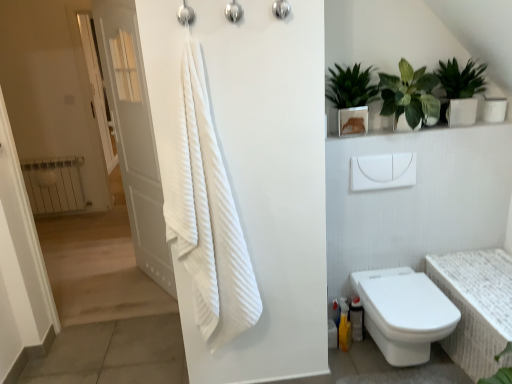
What do you see at coordinates (351, 98) in the screenshot?
I see `green glossy plant at upper right, arranged as the 3th houseplant when viewed from the right` at bounding box center [351, 98].

Measure the distance between white textured towel at center and camera.

4.82 feet.

What are the coordinates of `white textured towel at center` in the screenshot? It's located at (268, 187).

In order to click on white wood door at left in this screenshot , I will do `click(134, 137)`.

This screenshot has width=512, height=384. I want to click on white metallic radiator at left, so pos(54,184).

Locate an element on the screen. The width and height of the screenshot is (512, 384). green glossy plant at upper right, the 3th houseplant from the left is located at coordinates (460, 91).

From the white textured towel at center, count 1st shower to the right and point to it. Please provide its 2D coordinates.

[(233, 12)]

Consider the image. From a real-world perspective, which object rests below the other?

In real-world perspective, white textured towel at center is lower.

Could you measure the distance between white textured towel at center and brushed metal shower head at upper center, arranged as the 2th shower when viewed from the right?

white textured towel at center and brushed metal shower head at upper center, arranged as the 2th shower when viewed from the right, are 30.93 inches apart from each other.

Which of these two, brushed metal shower head at upper center, arranged as the 2th shower when viewed from the right, or brushed metal shower at upper center, which appears as the 1th shower when viewed from the left, is thinner?

brushed metal shower head at upper center, arranged as the 2th shower when viewed from the right.

What's the angular difference between brushed metal shower head at upper center, arranged as the 2th shower when viewed from the right, and brushed metal shower at upper center, which appears as the 1th shower when viewed from the left,'s facing directions?

0.000513 degrees separate the facing orientations of brushed metal shower head at upper center, arranged as the 2th shower when viewed from the right, and brushed metal shower at upper center, which appears as the 1th shower when viewed from the left.

Are brushed metal shower head at upper center, arranged as the 2th shower when viewed from the right, and brushed metal shower at upper center, acting as the 3th shower starting from the right, making contact?

No, brushed metal shower head at upper center, arranged as the 2th shower when viewed from the right, is not next to brushed metal shower at upper center, acting as the 3th shower starting from the right.

Considering the sizes of brushed metal shower head at upper center, which ranks as the 2th shower in left-to-right order, and brushed metal shower at upper center, which appears as the 1th shower when viewed from the left, in the image, is brushed metal shower head at upper center, which ranks as the 2th shower in left-to-right order, bigger or smaller than brushed metal shower at upper center, which appears as the 1th shower when viewed from the left,?

Clearly, brushed metal shower head at upper center, which ranks as the 2th shower in left-to-right order, is larger in size than brushed metal shower at upper center, which appears as the 1th shower when viewed from the left.

Between white plastic towel bar at upper center and metallic silver shower head at upper center, the first shower viewed from the right, which one has more height?

With more height is white plastic towel bar at upper center.

Does white plastic towel bar at upper center touch metallic silver shower head at upper center, the third shower when ordered from left to right?

white plastic towel bar at upper center and metallic silver shower head at upper center, the third shower when ordered from left to right, are clearly separated.

Which is behind, white plastic towel bar at upper center or metallic silver shower head at upper center, the third shower when ordered from left to right?

white plastic towel bar at upper center is behind.

Which is correct: white plastic towel bar at upper center is inside metallic silver shower head at upper center, the first shower viewed from the right, or outside of it?

white plastic towel bar at upper center cannot be found inside metallic silver shower head at upper center, the first shower viewed from the right.

Can you confirm if white textured bath at lower right is bigger than white metallic radiator at left?

Yes.

In the scene shown: Which of these two, white textured bath at lower right or white metallic radiator at left, stands shorter?

Standing shorter between the two is white textured bath at lower right.

From the image's perspective, is white textured bath at lower right beneath white metallic radiator at left?

Yes, from the image's perspective, white textured bath at lower right is below white metallic radiator at left.

Is white textured bath at lower right facing away from white metallic radiator at left?

No, white textured bath at lower right is not facing away from white metallic radiator at left.

Is white textured towel at center in contact with white glossy toilet at lower right?

white textured towel at center is not next to white glossy toilet at lower right, and they're not touching.

Is white textured towel at center to the left of white glossy toilet at lower right from the viewer's perspective?

Yes, white textured towel at center is to the left of white glossy toilet at lower right.

Looking at the image, does white textured towel at center seem bigger or smaller compared to white glossy toilet at lower right?

white textured towel at center is bigger than white glossy toilet at lower right.

Is white textured towel at center surrounding white glossy toilet at lower right?

No, white glossy toilet at lower right is not a part of white textured towel at center.

The width and height of the screenshot is (512, 384). What are the coordinates of `towel bar below the metallic silver shower head at upper center, the first shower viewed from the right (from a real-world perspective)` in the screenshot? It's located at [383, 171].

Is metallic silver shower head at upper center, the first shower viewed from the right, not near white plastic towel bar at upper center?

No, metallic silver shower head at upper center, the first shower viewed from the right, is not far away from white plastic towel bar at upper center.

Which of these two, metallic silver shower head at upper center, the first shower viewed from the right, or white plastic towel bar at upper center, is bigger?

With larger size is white plastic towel bar at upper center.

Is white textured towel at center looking in the opposite direction of green leafy plant at upper right, arranged as the 2th houseplant when viewed from the left?

No, white textured towel at center is not facing the opposite direction of green leafy plant at upper right, arranged as the 2th houseplant when viewed from the left.

From the image's perspective, which is below, white textured towel at center or green leafy plant at upper right, arranged as the 2th houseplant when viewed from the left?

white textured towel at center is shown below in the image.

Is white textured towel at center outside of green leafy plant at upper right, which is the second houseplant from right to left?

That's correct, white textured towel at center is outside of green leafy plant at upper right, which is the second houseplant from right to left.

How different are the orientations of white textured towel at center and green leafy plant at upper right, which is the second houseplant from right to left, in degrees?

They differ by 0.00315 degrees in their facing directions.

In the image, there is a brushed metal shower head at upper center, arranged as the 2th shower when viewed from the right. Where is `screen door below it (from the image's perspective)`? The width and height of the screenshot is (512, 384). screen door below it (from the image's perspective) is located at coordinates (268, 187).

Where is `shower lying in front of the brushed metal shower head at upper center, which ranks as the 2th shower in left-to-right order`? shower lying in front of the brushed metal shower head at upper center, which ranks as the 2th shower in left-to-right order is located at coordinates (185, 14).

Based on their spatial positions, is brushed metal shower at upper center, which appears as the 1th shower when viewed from the left, or white metallic radiator at left further from white textured towel at center?

Among the two, white metallic radiator at left is located further to white textured towel at center.

Which object lies nearer to the anchor point white plastic towel bar at upper center, white glossy toilet at lower right or green glossy plant at upper right, which appears as the 1th houseplant when viewed from the left?

Based on the image, green glossy plant at upper right, which appears as the 1th houseplant when viewed from the left, appears to be nearer to white plastic towel bar at upper center.

When comparing their distances from metallic silver shower head at upper center, the third shower when ordered from left to right, does white textured bath at lower right or white metallic radiator at left seem closer?

Among the two, white textured bath at lower right is located nearer to metallic silver shower head at upper center, the third shower when ordered from left to right.

When comparing their distances from metallic silver shower head at upper center, the third shower when ordered from left to right, does white plastic towel bar at upper center or brushed metal shower at upper center, acting as the 3th shower starting from the right, seem closer?

The object closer to metallic silver shower head at upper center, the third shower when ordered from left to right, is brushed metal shower at upper center, acting as the 3th shower starting from the right.

Which object lies nearer to the anchor point green glossy plant at upper right, which appears as the 1th houseplant when viewed from the left, brushed metal shower at upper center, which appears as the 1th shower when viewed from the left, or green glossy plant at upper right, the 3th houseplant from the left?

green glossy plant at upper right, the 3th houseplant from the left.

In the scene shown: Considering their positions, is green glossy plant at upper right, arranged as the 3th houseplant when viewed from the right, positioned further to white textured towel at center than white glossy toilet at lower right?

The object further to white textured towel at center is green glossy plant at upper right, arranged as the 3th houseplant when viewed from the right.

In the scene shown: From the image, which object appears to be farther from brushed metal shower head at upper center, arranged as the 2th shower when viewed from the right, brushed metal shower at upper center, which appears as the 1th shower when viewed from the left, or green glossy plant at upper right, which appears as the 1th houseplant when viewed from the left?

Among the two, green glossy plant at upper right, which appears as the 1th houseplant when viewed from the left, is located further to brushed metal shower head at upper center, arranged as the 2th shower when viewed from the right.

Considering their positions, is green leafy plant at upper right, which is the second houseplant from right to left, positioned closer to white textured towel at center than green glossy plant at upper right, the 3th houseplant from the left?

Based on the image, green leafy plant at upper right, which is the second houseplant from right to left, appears to be nearer to white textured towel at center.

Image resolution: width=512 pixels, height=384 pixels. In order to click on towel bar between brushed metal shower at upper center, acting as the 3th shower starting from the right, and green glossy plant at upper right, acting as the 1th houseplant starting from the right, in the horizontal direction in this screenshot , I will do `click(383, 171)`.

Where is `screen door between brushed metal shower at upper center, which appears as the 1th shower when viewed from the left, and white glossy toilet at lower right from top to bottom`? Image resolution: width=512 pixels, height=384 pixels. screen door between brushed metal shower at upper center, which appears as the 1th shower when viewed from the left, and white glossy toilet at lower right from top to bottom is located at coordinates (268, 187).

Image resolution: width=512 pixels, height=384 pixels. Find the location of `towel bar between brushed metal shower head at upper center, arranged as the 2th shower when viewed from the right, and white textured bath at lower right vertically`. towel bar between brushed metal shower head at upper center, arranged as the 2th shower when viewed from the right, and white textured bath at lower right vertically is located at coordinates coord(383,171).

Where is `houseplant between brushed metal shower head at upper center, arranged as the 2th shower when viewed from the right, and white plastic towel bar at upper center`? The width and height of the screenshot is (512, 384). houseplant between brushed metal shower head at upper center, arranged as the 2th shower when viewed from the right, and white plastic towel bar at upper center is located at coordinates (351, 98).